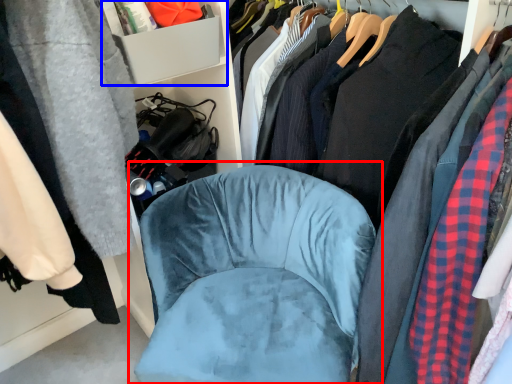
Question: Which of the following is the closest to the observer, chair (highlighted by a red box) or cabinet (highlighted by a blue box)?

Choices:
 (A) chair
 (B) cabinet

Answer: (A)